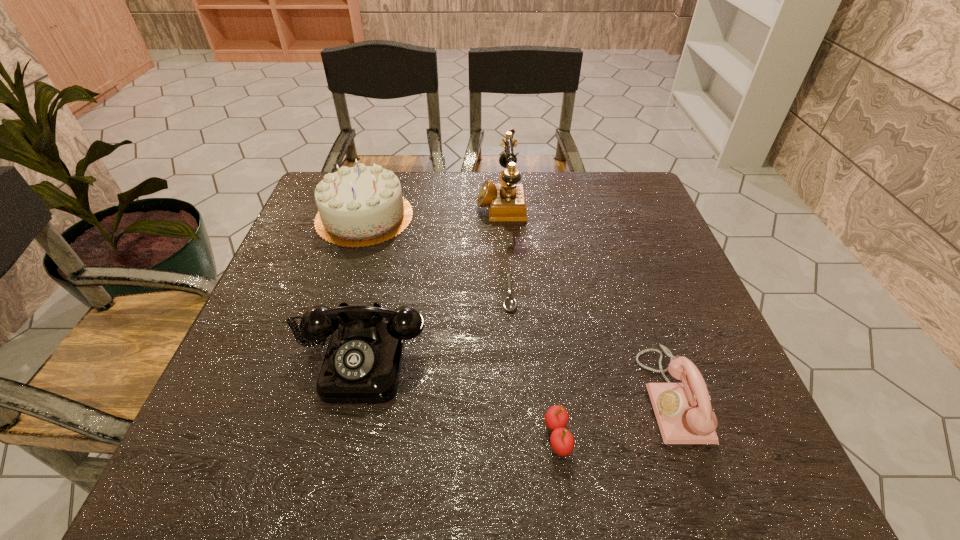
Identify the location of vacant space at the near left corner. The width and height of the screenshot is (960, 540). (245, 438).

You are a GUI agent. You are given a task and a screenshot of the screen. Output one action in this format:
    pyautogui.click(x=<x>, y=<y>)
    Task: Click on the vacant space at the far right corner of the desktop
    The width and height of the screenshot is (960, 540).
    Given the screenshot: What is the action you would take?
    (628, 183)

Find the location of a particular element. vacant space at the near right corner of the desktop is located at coordinates (727, 481).

I want to click on vacant space that is in between the cherry and the tallest object, so click(529, 319).

Where is `empty location between the second telephone from left to right and the shortest object`? This screenshot has height=540, width=960. empty location between the second telephone from left to right and the shortest object is located at coordinates (505, 248).

Find the location of a particular element. This screenshot has height=540, width=960. free space that is in between the fifth shortest object and the shortest object is located at coordinates (437, 255).

I want to click on vacant space that's between the rightmost object and the fifth tallest object, so click(x=614, y=416).

In order to click on vacant space in between the third farthest object and the second shortest object in this screenshot , I will do `click(534, 365)`.

Where is `vacant space that's between the tallest object and the rightmost object`? vacant space that's between the tallest object and the rightmost object is located at coordinates (587, 299).

The height and width of the screenshot is (540, 960). Find the location of `unoccupied area between the leftmost telephone and the second shortest object`. unoccupied area between the leftmost telephone and the second shortest object is located at coordinates (459, 396).